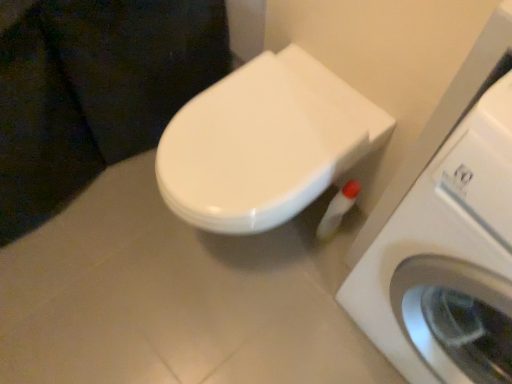
Question: Considering the relative sizes of white glossy toilet paper at lower right and white glossy toilet at center in the image provided, is white glossy toilet paper at lower right smaller than white glossy toilet at center?

Choices:
 (A) no
 (B) yes

Answer: (B)

Question: Could you tell me if white glossy toilet paper at lower right is facing white glossy toilet at center?

Choices:
 (A) no
 (B) yes

Answer: (A)

Question: Are white glossy toilet paper at lower right and white glossy toilet at center far apart?

Choices:
 (A) yes
 (B) no

Answer: (B)

Question: From a real-world perspective, is white glossy toilet paper at lower right over white glossy toilet at center?

Choices:
 (A) no
 (B) yes

Answer: (A)

Question: From a real-world perspective, is white glossy toilet paper at lower right beneath white glossy toilet at center?

Choices:
 (A) no
 (B) yes

Answer: (B)

Question: Is white glossy toilet paper at lower right positioned beyond the bounds of white glossy toilet at center?

Choices:
 (A) no
 (B) yes

Answer: (B)

Question: From the image's perspective, is white plastic washing machine at right below white glossy toilet paper at lower right?

Choices:
 (A) yes
 (B) no

Answer: (A)

Question: Is white plastic washing machine at right to the right of white glossy toilet paper at lower right from the viewer's perspective?

Choices:
 (A) no
 (B) yes

Answer: (B)

Question: Is white plastic washing machine at right closer to the viewer compared to white glossy toilet paper at lower right?

Choices:
 (A) no
 (B) yes

Answer: (B)

Question: Is white plastic washing machine at right bigger than white glossy toilet paper at lower right?

Choices:
 (A) no
 (B) yes

Answer: (B)

Question: From a real-world perspective, is white plastic washing machine at right positioned over white glossy toilet paper at lower right based on gravity?

Choices:
 (A) no
 (B) yes

Answer: (B)

Question: Does white plastic washing machine at right have a lesser height compared to white glossy toilet paper at lower right?

Choices:
 (A) yes
 (B) no

Answer: (B)

Question: Is white plastic washing machine at right inside white glossy toilet at center?

Choices:
 (A) no
 (B) yes

Answer: (A)